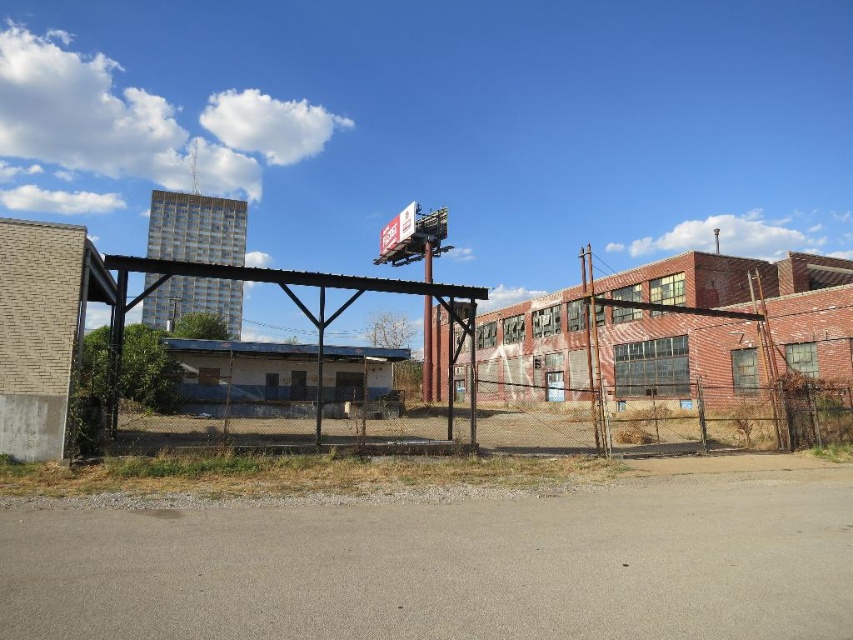
You are a delivery driver who needs to enter the fenced area to drop off a package. The entrance is at the bottom of the white plastic billboard at upper center. Can you drive through the gap between the rusty metal fence at center and the billboard?

The rusty metal fence at center is positioned under the white plastic billboard at upper center, so there is no gap between them. You cannot drive through that area.

You are a delivery person trying to see if a tall package can be delivered through the rusty metal fence at center. The package is as tall as the white plastic billboard at upper center. Can the package pass through the fence?

The rusty metal fence at center is shorter than the white plastic billboard at upper center. Since the package is as tall as the billboard, it would be taller than the fence, so the package cannot pass through the fence without being damaged or requiring removal.

You are a city planner evaluating the urban space. You notice the rusty metal fence at center and the white plastic billboard at upper center. Which object takes up more space in the scene?

The white plastic billboard at upper center takes up more space in the scene because the rusty metal fence at center has a smaller size compared to it.